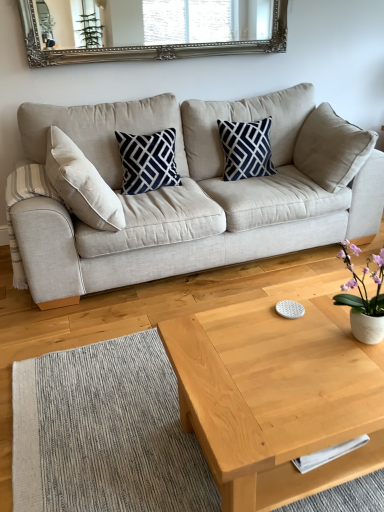
Identify the location of vacant area on the back side of white ceramic vase at right. (323, 310).